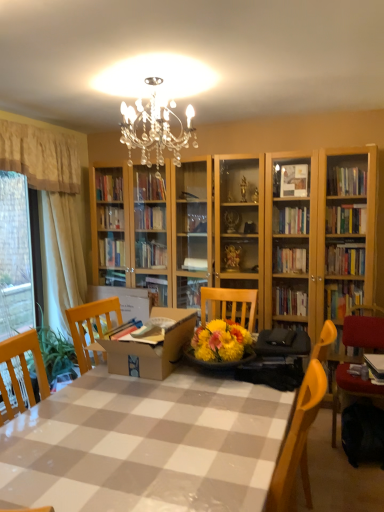
Question: Can we say checkered plastic table at center lies outside cardboard box at center?

Choices:
 (A) yes
 (B) no

Answer: (A)

Question: From the image's perspective, is checkered plastic table at center located above cardboard box at center?

Choices:
 (A) no
 (B) yes

Answer: (A)

Question: Considering the relative positions of checkered plastic table at center and cardboard box at center in the image provided, is checkered plastic table at center to the right of cardboard box at center from the viewer's perspective?

Choices:
 (A) yes
 (B) no

Answer: (A)

Question: Considering the relative sizes of checkered plastic table at center and cardboard box at center in the image provided, is checkered plastic table at center shorter than cardboard box at center?

Choices:
 (A) yes
 (B) no

Answer: (B)

Question: From a real-world perspective, is checkered plastic table at center physically below cardboard box at center?

Choices:
 (A) yes
 (B) no

Answer: (A)

Question: Relative to checkered plastic table at center, is white sheer curtain at left, acting as the first curtain starting from the left, in front or behind?

Choices:
 (A) front
 (B) behind

Answer: (B)

Question: Considering the positions of point (43, 222) and point (46, 411), is point (43, 222) closer or farther from the camera than point (46, 411)?

Choices:
 (A) closer
 (B) farther

Answer: (B)

Question: In terms of size, does white sheer curtain at left, which is the third curtain from right to left, appear bigger or smaller than checkered plastic table at center?

Choices:
 (A) small
 (B) big

Answer: (A)

Question: Is white sheer curtain at left, which is the third curtain from right to left, inside the boundaries of checkered plastic table at center, or outside?

Choices:
 (A) inside
 (B) outside

Answer: (B)

Question: From a real-world perspective, is beige fabric curtain at left, the 3th curtain when ordered from left to right, above or below cardboard box at center?

Choices:
 (A) above
 (B) below

Answer: (A)

Question: Is beige fabric curtain at left, placed as the first curtain when sorted from right to left, situated inside cardboard box at center or outside?

Choices:
 (A) inside
 (B) outside

Answer: (B)

Question: Is beige fabric curtain at left, placed as the first curtain when sorted from right to left, wider or thinner than cardboard box at center?

Choices:
 (A) wide
 (B) thin

Answer: (B)

Question: Does point (74, 279) appear closer or farther from the camera than point (130, 353)?

Choices:
 (A) farther
 (B) closer

Answer: (A)

Question: Do you think beige fabric curtain at left, marked as the 2th curtain in a left-to-right arrangement, is within beige fabric curtain at left, the 3th curtain when ordered from left to right, or outside of it?

Choices:
 (A) inside
 (B) outside

Answer: (B)

Question: From a real-world perspective, is beige fabric curtain at left, marked as the 2th curtain in a left-to-right arrangement, above or below beige fabric curtain at left, placed as the first curtain when sorted from right to left?

Choices:
 (A) above
 (B) below

Answer: (A)